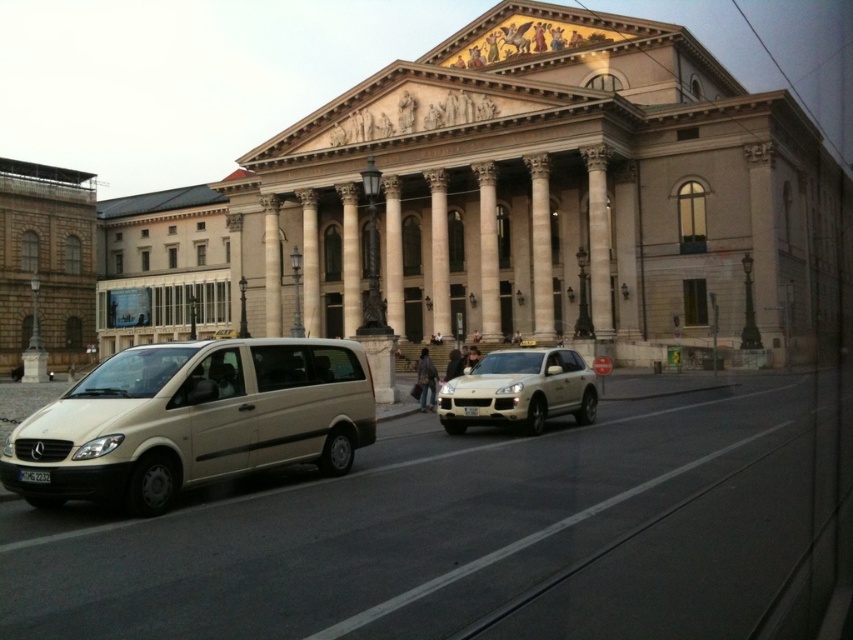
Question: Can you confirm if beige matte van at lower left is bigger than metallic gold suv at center?

Choices:
 (A) yes
 (B) no

Answer: (A)

Question: Among these points, which one is farthest from the camera?

Choices:
 (A) (129, 476)
 (B) (544, 381)

Answer: (B)

Question: Observing the image, what is the correct spatial positioning of beige matte van at lower left in reference to metallic gold suv at center?

Choices:
 (A) above
 (B) below

Answer: (B)

Question: Is beige matte van at lower left positioned before metallic gold suv at center?

Choices:
 (A) no
 (B) yes

Answer: (B)